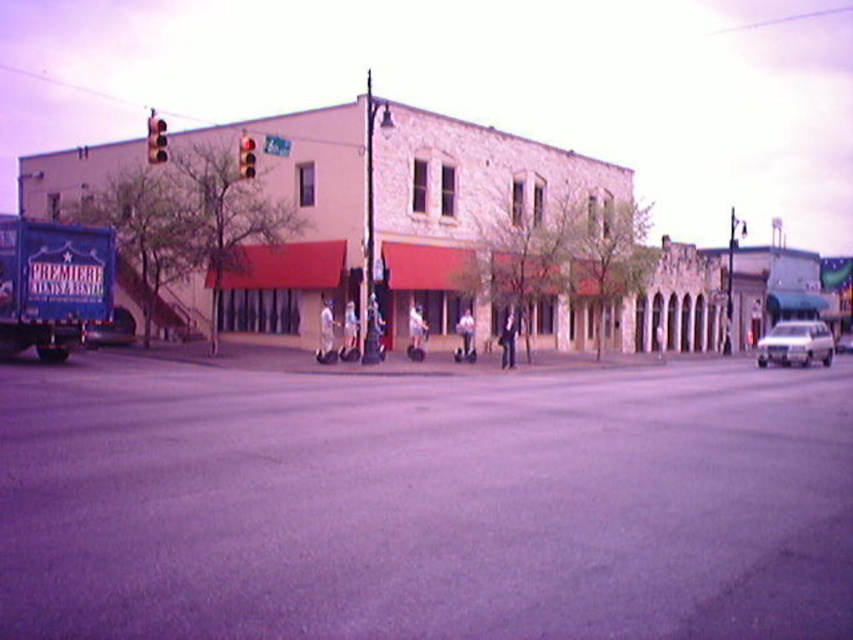
You are a delivery person trying to navigate through the street scene. You need to determine if the dark asphalt road at center is tall enough to allow a tall delivery truck to pass under the red glass traffic light at upper center. Can you confirm this?

The dark asphalt road at center is not as tall as the red glass traffic light at upper center, meaning the road itself does not have a height restriction. Therefore, the tall delivery truck can pass under the red glass traffic light at upper center without any issues.

You are a delivery person trying to navigate through the street. You see a metallic traffic light at upper left and a red glass traffic light at upper center. Which traffic light is larger in size?

The metallic traffic light at upper left is bigger than the red glass traffic light at upper center.

What is the spatial relationship between the metallic traffic light at upper left and the red glass traffic light at upper center in the scene?

The metallic traffic light at upper left is positioned to the left of the red glass traffic light at upper center.